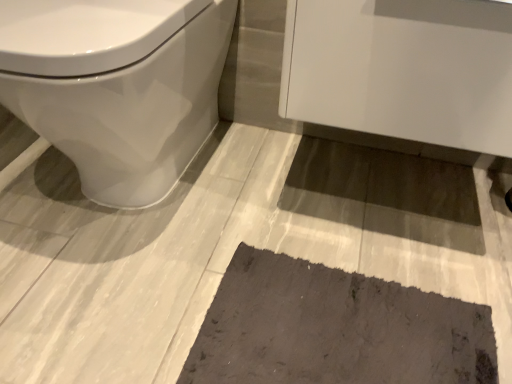
At what (x,y) coordinates should I click in order to perform the action: click on vacant area that lies between white glossy toilet at left and dark gray textured bath mat at lower center. Please return your answer as a coordinate pair (x, y). Looking at the image, I should click on (258, 233).